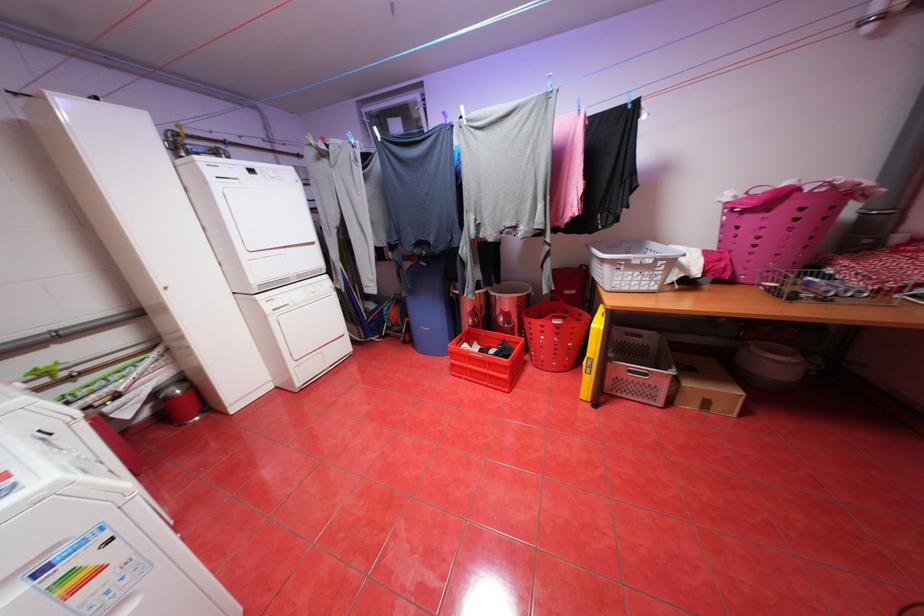
This screenshot has height=616, width=924. What do you see at coordinates (280, 309) in the screenshot?
I see `the washing machine handle` at bounding box center [280, 309].